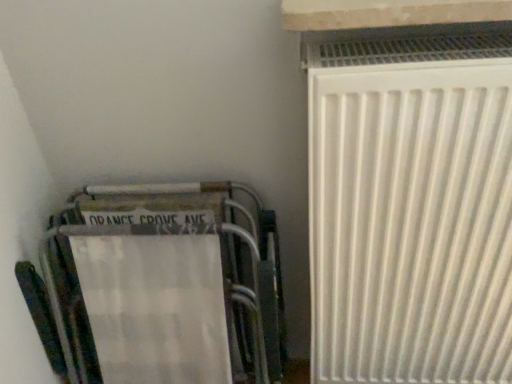
Question: Is point (502, 304) positioned closer to the camera than point (411, 19)?

Choices:
 (A) closer
 (B) farther

Answer: (B)

Question: In terms of width, does white matte radiator at right look wider or thinner when compared to white stone window sill at upper right?

Choices:
 (A) wide
 (B) thin

Answer: (B)

Question: Based on their relative distances, which object is farther from the metallic silver folding chair at lower left?

Choices:
 (A) white matte radiator at right
 (B) white stone window sill at upper right

Answer: (B)

Question: Which is nearer to the metallic silver folding chair at lower left?

Choices:
 (A) white stone window sill at upper right
 (B) white matte radiator at right

Answer: (B)